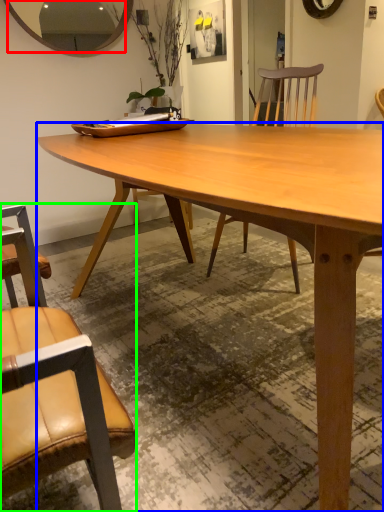
Question: Considering the real-world distances, which object is farthest from mirror (highlighted by a red box)? desk (highlighted by a blue box) or chair (highlighted by a green box)?

Choices:
 (A) desk
 (B) chair

Answer: (B)